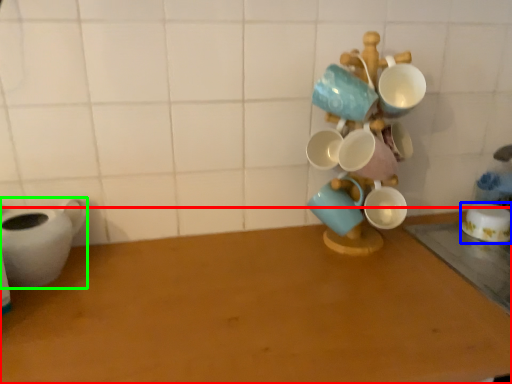
Question: Based on their relative distances, which object is farther from table (highlighted by a red box)? Choose from coffee cup (highlighted by a blue box) and tableware (highlighted by a green box).

Choices:
 (A) coffee cup
 (B) tableware

Answer: (A)